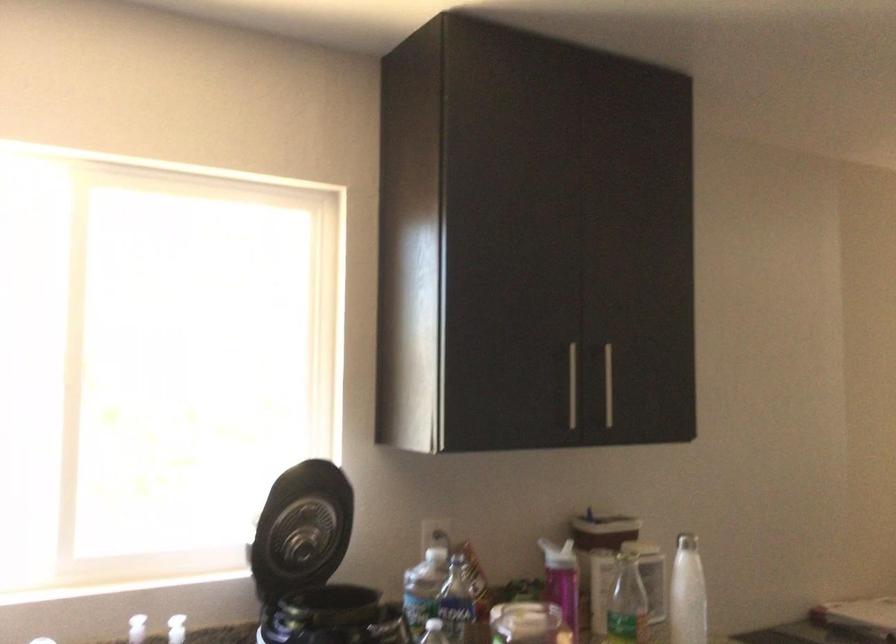
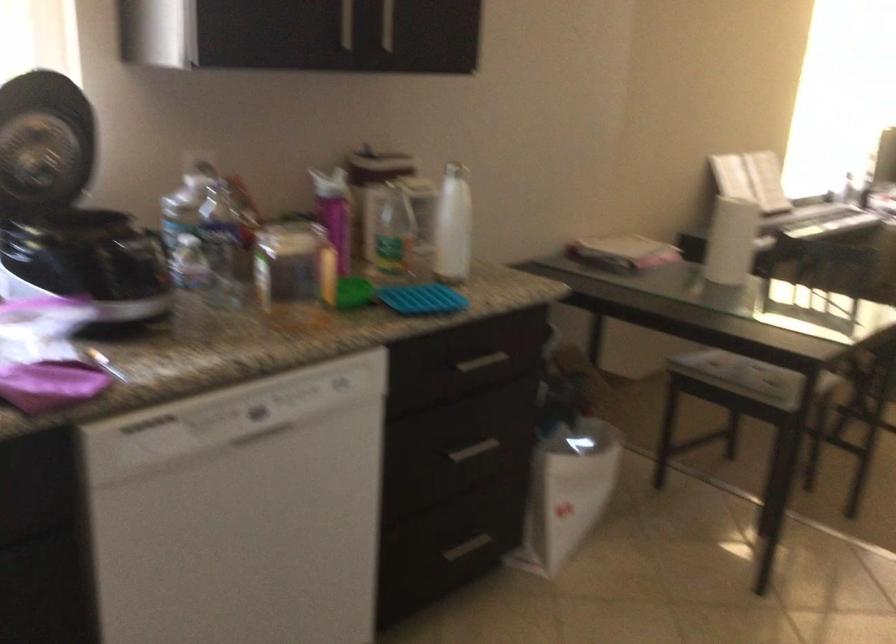
What movement of the cameraman would produce the second image?

The cameraman walked toward right, forward.